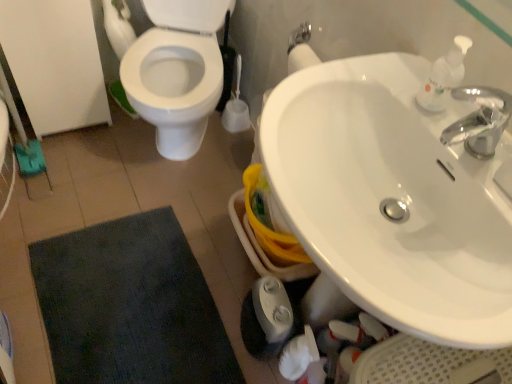
Question: Would you say white plastic soap dispenser at upper right is outside white glossy sink at upper right?

Choices:
 (A) yes
 (B) no

Answer: (A)

Question: Can you confirm if white plastic soap dispenser at upper right is positioned to the right of white glossy sink at upper right?

Choices:
 (A) yes
 (B) no

Answer: (A)

Question: Is white glossy sink at upper right at the back of white plastic soap dispenser at upper right?

Choices:
 (A) yes
 (B) no

Answer: (B)

Question: Can you confirm if white plastic soap dispenser at upper right is taller than white glossy sink at upper right?

Choices:
 (A) no
 (B) yes

Answer: (A)

Question: Is white plastic soap dispenser at upper right thinner than white glossy sink at upper right?

Choices:
 (A) no
 (B) yes

Answer: (B)

Question: Is white plastic soap dispenser at upper right wider than white glossy sink at upper right?

Choices:
 (A) yes
 (B) no

Answer: (B)

Question: Is white glossy sink at upper right facing away from dark blue textured bath mat at lower left?

Choices:
 (A) no
 (B) yes

Answer: (A)

Question: Are white glossy sink at upper right and dark blue textured bath mat at lower left making contact?

Choices:
 (A) yes
 (B) no

Answer: (B)

Question: From a real-world perspective, is white glossy sink at upper right physically above dark blue textured bath mat at lower left?

Choices:
 (A) yes
 (B) no

Answer: (A)

Question: Does white glossy sink at upper right have a lesser width compared to dark blue textured bath mat at lower left?

Choices:
 (A) yes
 (B) no

Answer: (A)

Question: From the image's perspective, is white glossy sink at upper right located beneath dark blue textured bath mat at lower left?

Choices:
 (A) no
 (B) yes

Answer: (A)

Question: Can you confirm if white glossy sink at upper right is positioned to the left of dark blue textured bath mat at lower left?

Choices:
 (A) yes
 (B) no

Answer: (B)

Question: Is white glossy sink at upper right to the right of white plastic soap dispenser at upper right from the viewer's perspective?

Choices:
 (A) no
 (B) yes

Answer: (A)